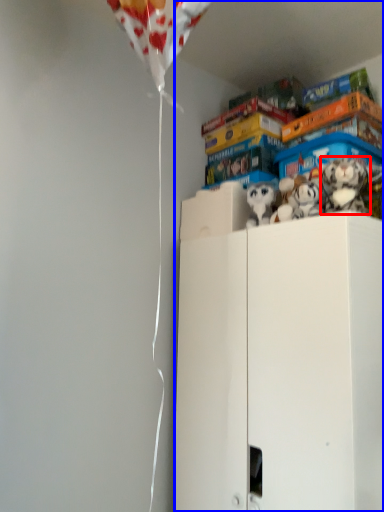
Question: Which object appears closest to the camera in this image, toy (highlighted by a red box) or cabinetry (highlighted by a blue box)?

Choices:
 (A) toy
 (B) cabinetry

Answer: (B)